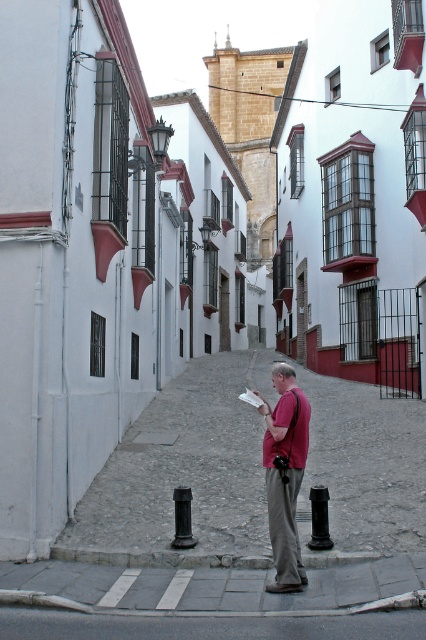
Question: Can you confirm if smooth stone alley at center is positioned above black matte pole at lower center?

Choices:
 (A) yes
 (B) no

Answer: (A)

Question: Does matte red shirt at center come in front of black glossy pole at center?

Choices:
 (A) no
 (B) yes

Answer: (B)

Question: Is matte red shirt at center to the right of black glossy pole at center from the viewer's perspective?

Choices:
 (A) yes
 (B) no

Answer: (A)

Question: Based on their relative distances, which object is nearer to the black glossy pole at center?

Choices:
 (A) matte red shirt at center
 (B) smooth stone alley at center

Answer: (A)

Question: Among these points, which one is nearest to the camera?

Choices:
 (A) (279, 429)
 (B) (397, 444)
 (C) (322, 508)

Answer: (A)

Question: Which object is the closest to the matte red shirt at center?

Choices:
 (A) black matte pole at lower center
 (B) smooth stone alley at center

Answer: (A)